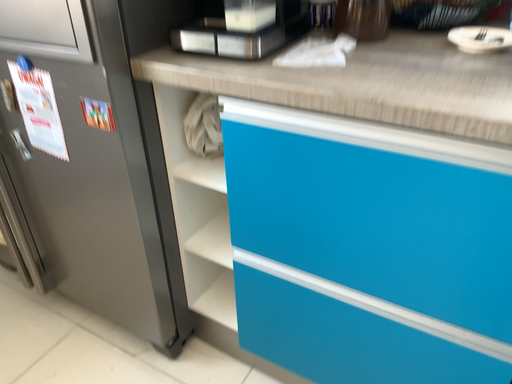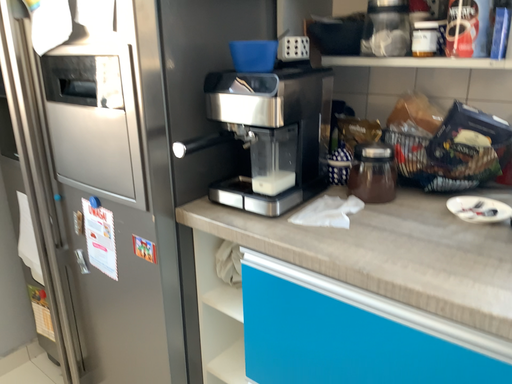
Question: How did the camera likely rotate when shooting the video?

Choices:
 (A) rotated downward
 (B) rotated upward

Answer: (B)